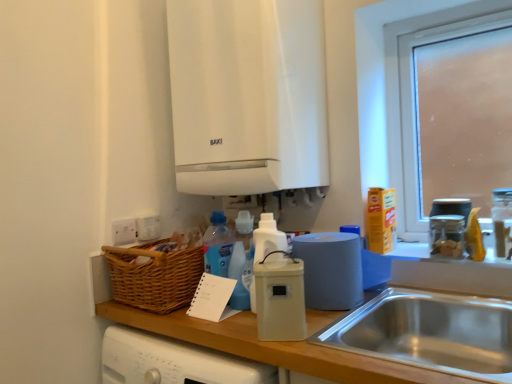
Question: In the image, is white matte boiler at upper center on the left side or the right side of frosted glass window at upper right?

Choices:
 (A) left
 (B) right

Answer: (A)

Question: Looking at their shapes, would you say white matte boiler at upper center is wider or thinner than frosted glass window at upper right?

Choices:
 (A) thin
 (B) wide

Answer: (B)

Question: Based on their relative distances, which object is farther from the white plastic bottle at center, acting as the 2th bottle starting from the right?

Choices:
 (A) frosted glass window at upper right
 (B) white matte boiler at upper center
 (C) wooden at lower left
 (D) matte plastic roll of paper towels at center, arranged as the first kitchen appliance when viewed from the back
 (E) white plastic container at center, which appears as the second kitchen appliance when viewed from the back

Answer: (A)

Question: Which of these objects is positioned farthest from the clear glass jar at right?

Choices:
 (A) white matte boiler at upper center
 (B) blue matte paper towel roll at right
 (C) white plastic bottle at center, acting as the 2th bottle starting from the right
 (D) clear glass jar at upper right, placed as the first bottle when sorted from right to left
 (E) stainless steel sink at lower right

Answer: (A)